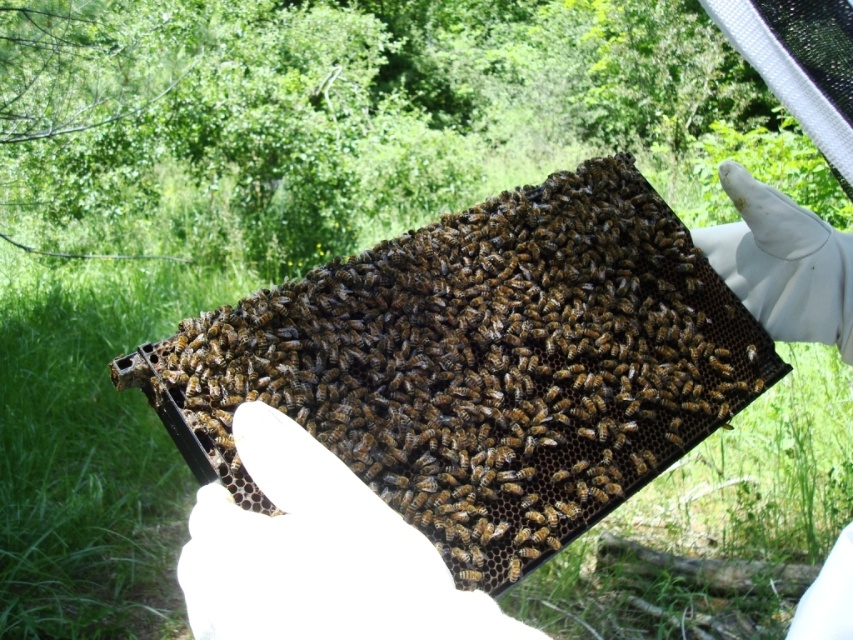
Question: Does white glove at center appear on the left side of brown fuzzy bee at center?

Choices:
 (A) no
 (B) yes

Answer: (A)

Question: Which object is farther from the camera taking this photo?

Choices:
 (A) brown matte honeycomb at center
 (B) brown fuzzy bee at center
 (C) white glove at center

Answer: (B)

Question: In this image, where is brown matte honeycomb at center located relative to brown fuzzy bee at center?

Choices:
 (A) right
 (B) left

Answer: (B)

Question: Does brown matte honeycomb at center appear on the right side of brown fuzzy bee at center?

Choices:
 (A) yes
 (B) no

Answer: (B)

Question: Estimate the real-world distances between objects in this image. Which object is farther from the brown fuzzy bee at center?

Choices:
 (A) brown matte honeycomb at center
 (B) white glove at center

Answer: (A)

Question: Which of the following is the farthest from the observer?

Choices:
 (A) (755, 358)
 (B) (711, 237)
 (C) (573, 193)

Answer: (B)